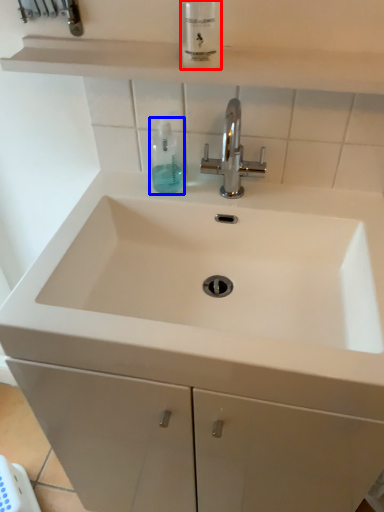
Question: Which object is closer to the camera taking this photo, mouthwash (highlighted by a red box) or mouthwash (highlighted by a blue box)?

Choices:
 (A) mouthwash
 (B) mouthwash

Answer: (A)